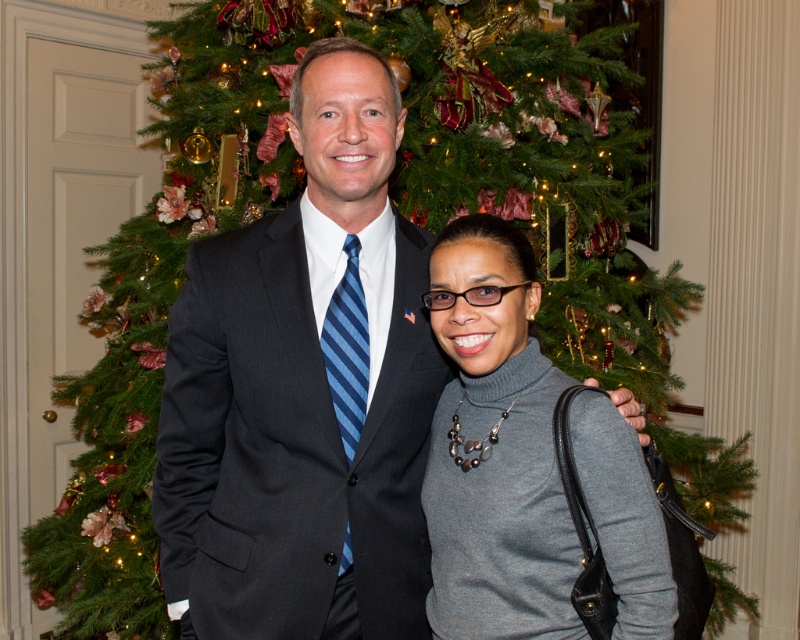
Which is more to the right, dark gray suit at center or gray matte turtleneck sweater at center?

gray matte turtleneck sweater at center is more to the right.

Who is taller, dark gray suit at center or gray matte turtleneck sweater at center?

dark gray suit at center

Find the location of `dark gray suit at center`. dark gray suit at center is located at coordinates (304, 390).